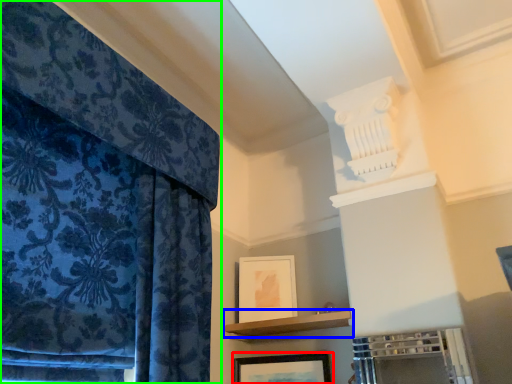
Question: Estimate the real-world distances between objects in this image. Which object is closer to picture frame (highlighted by a red box), shelf (highlighted by a blue box) or curtain (highlighted by a green box)?

Choices:
 (A) shelf
 (B) curtain

Answer: (A)